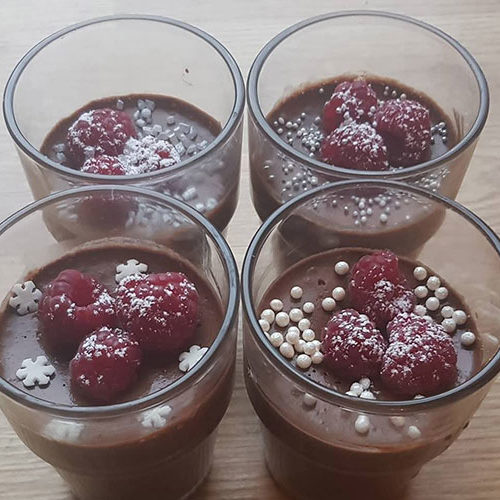
At what (x,y) coordinates should I click in order to perform the action: click on cup. Please return your answer as a coordinate pair (x, y). This screenshot has width=500, height=500. Looking at the image, I should click on (156, 61), (347, 42), (479, 278), (187, 245).